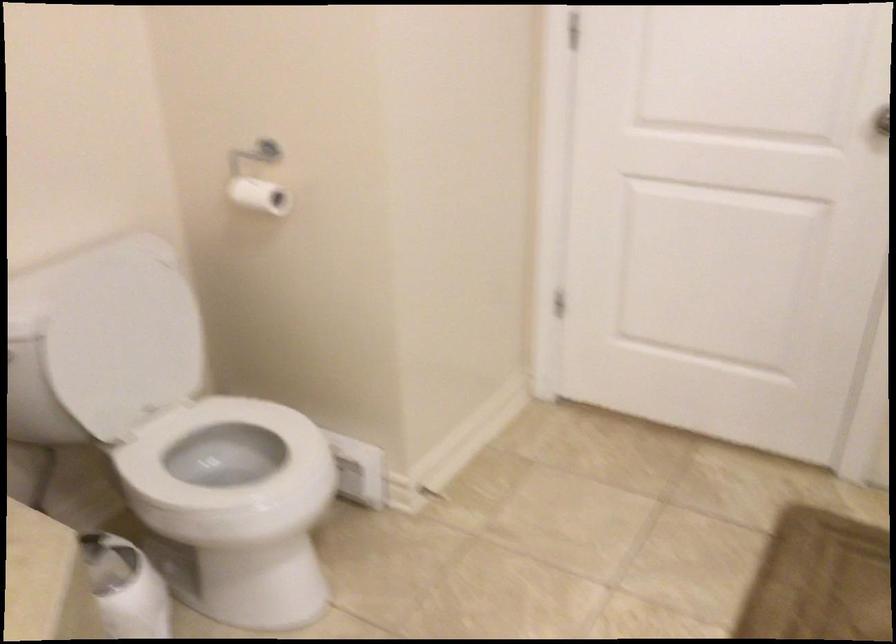
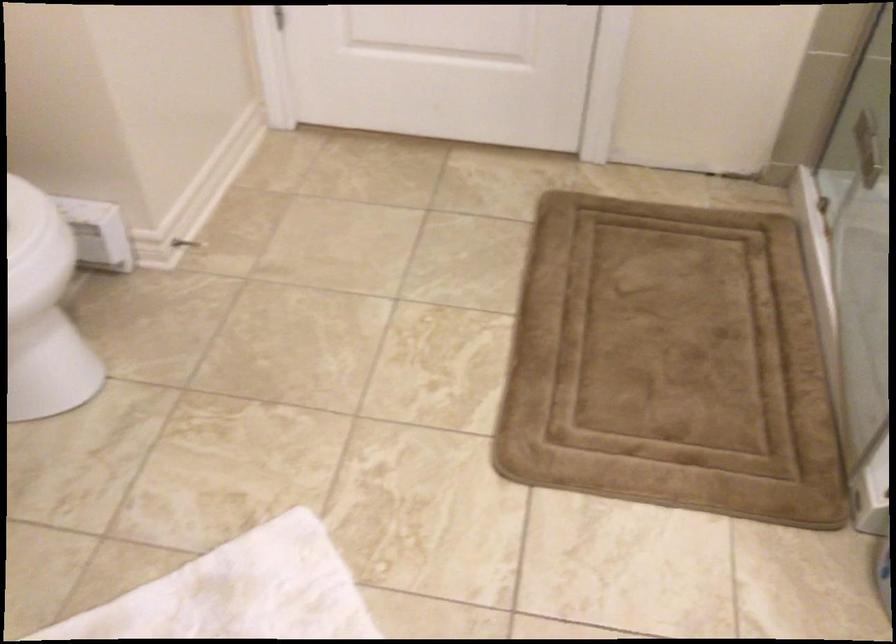
Locate, in the second image, the point that corresponds to point (554, 298) in the first image.

(274, 17)